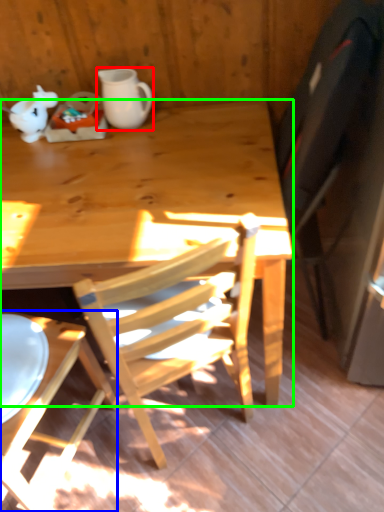
Question: Estimate the real-world distances between objects in this image. Which object is closer to coffee cup (highlighted by a red box), chair (highlighted by a blue box) or desk (highlighted by a green box)?

Choices:
 (A) chair
 (B) desk

Answer: (B)